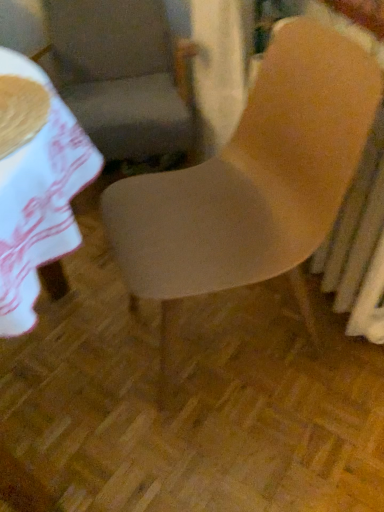
Where is `vacant region in front of matte wood chair at center, the second chair positioned from the back`? This screenshot has width=384, height=512. vacant region in front of matte wood chair at center, the second chair positioned from the back is located at coordinates (269, 442).